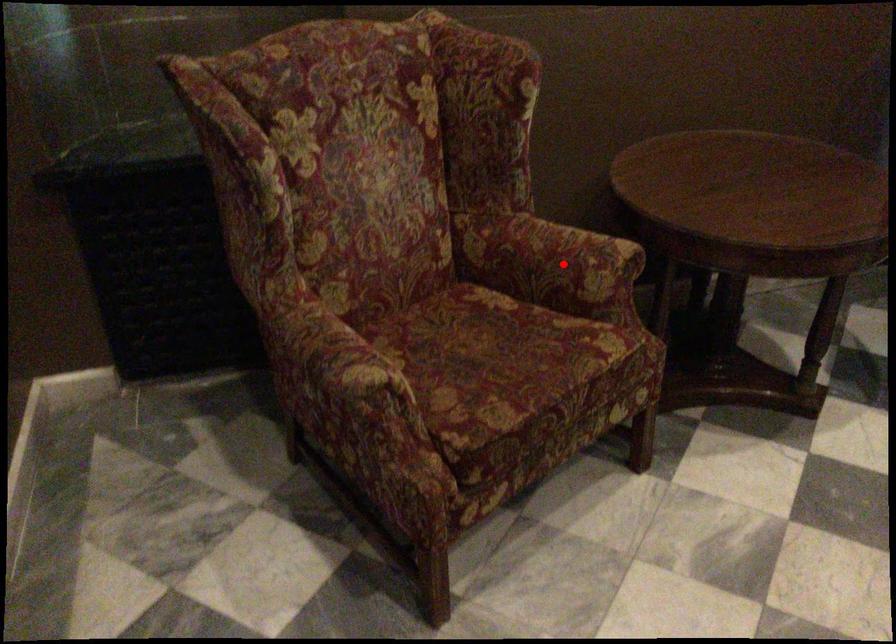
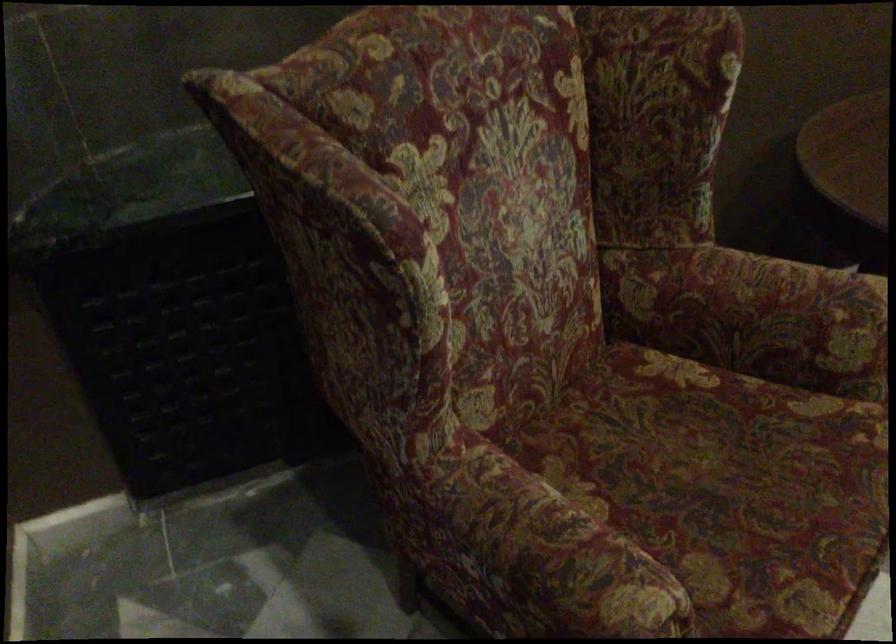
In the second image, find the point that corresponds to the highlighted location in the first image.

(786, 321)